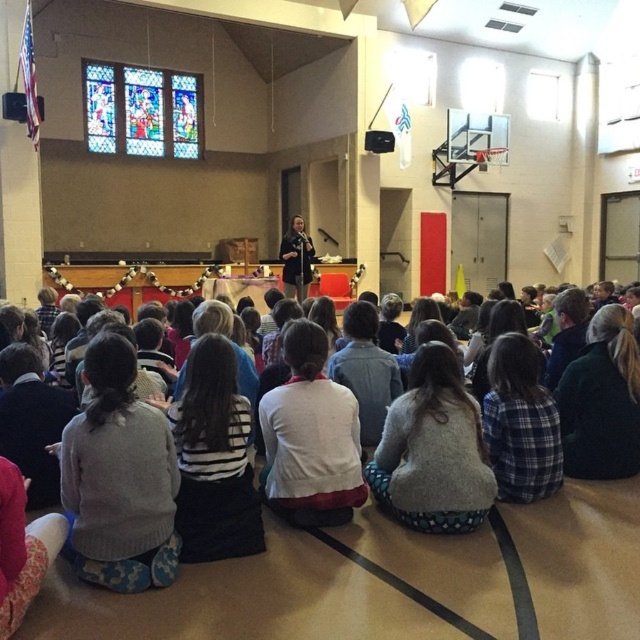
You are a photographer setting up for a group photo in the gymnasium. You need to ensure that the white sweater at center and the dark blue sweater at center are both visible in the frame. Based on their positions, which sweater might require you to adjust the camera angle more to include it in the shot?

The white sweater at center might be wider than the dark blue sweater at center, so it could require a wider camera angle to ensure it fits entirely within the frame.

Looking at this image, you are standing at the entrance of the gymnasium and want to find the white sweater at center. Based on the coordinates provided, which direction should you look to locate it?

The white sweater at center is located at coordinates point (365, 371), so you should look towards the center of the gymnasium to find it.